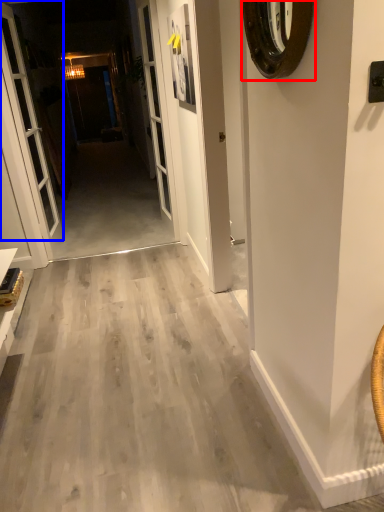
Question: Among these objects, which one is nearest to the camera, clock (highlighted by a red box) or door (highlighted by a blue box)?

Choices:
 (A) clock
 (B) door

Answer: (A)